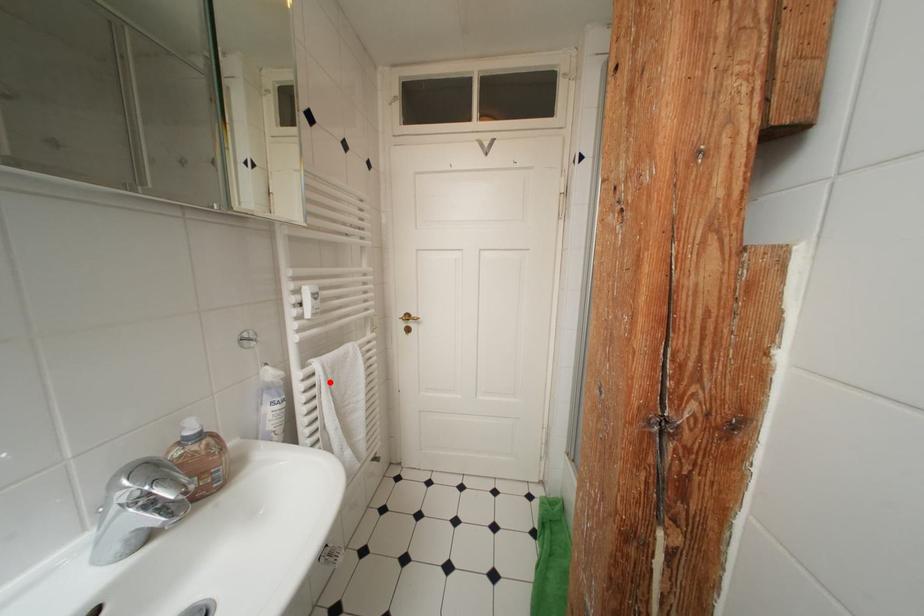
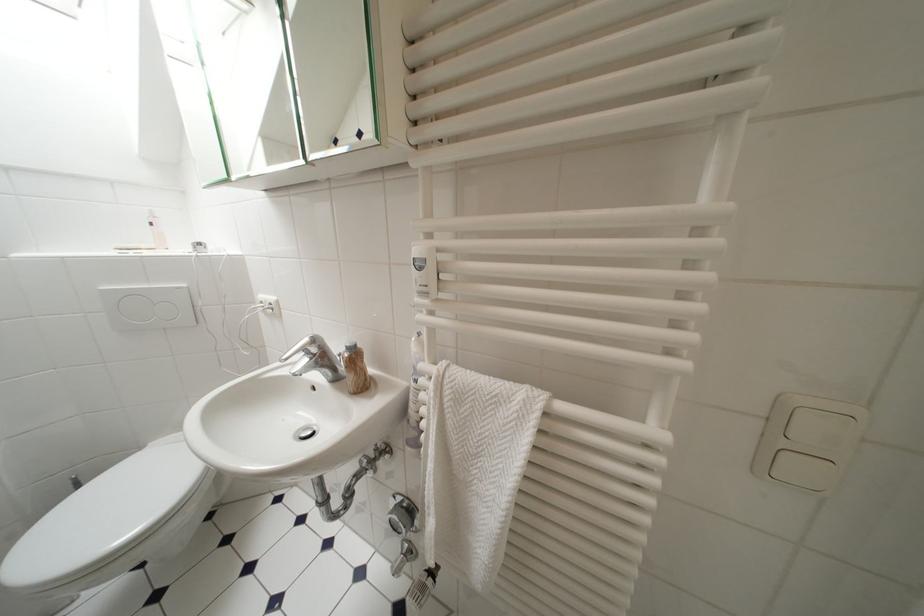
Question: I am providing you with two images of the same scene from different viewpoints. A red point is shown in image1. For the corresponding object point in image2, is it positioned nearer or farther from the camera?

Choices:
 (A) Nearer
 (B) Farther

Answer: (B)